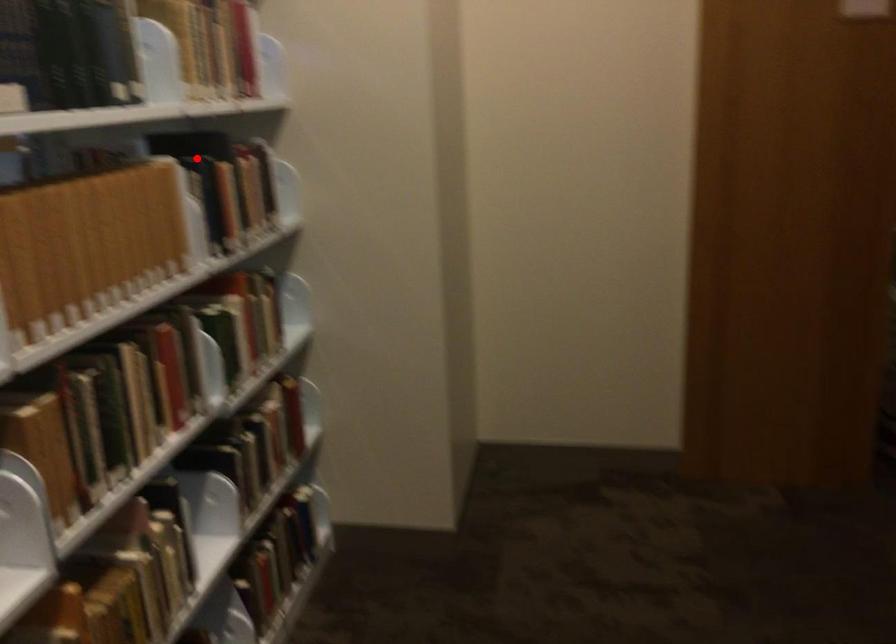
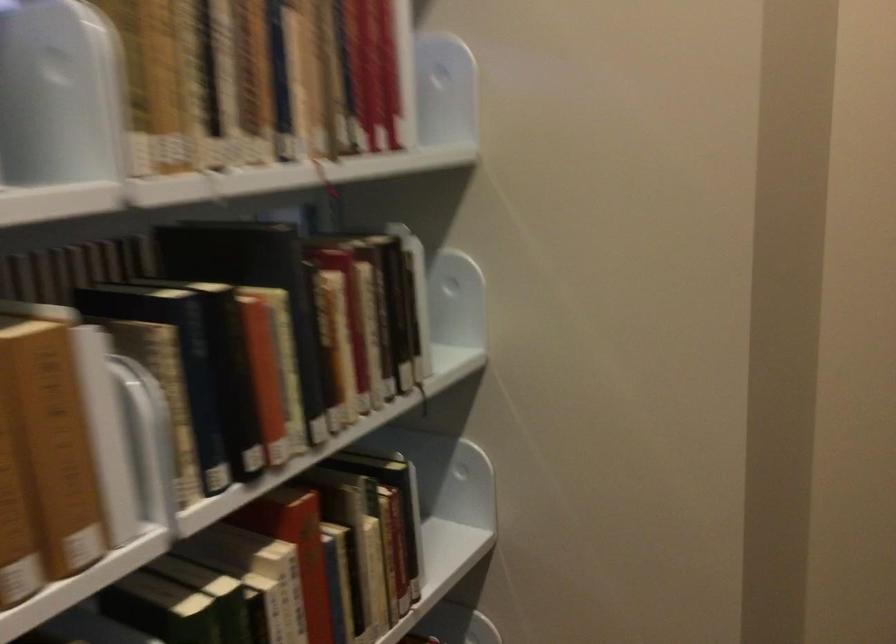
In the second image, find the point that corresponds to the highlighted location in the first image.

(188, 288)